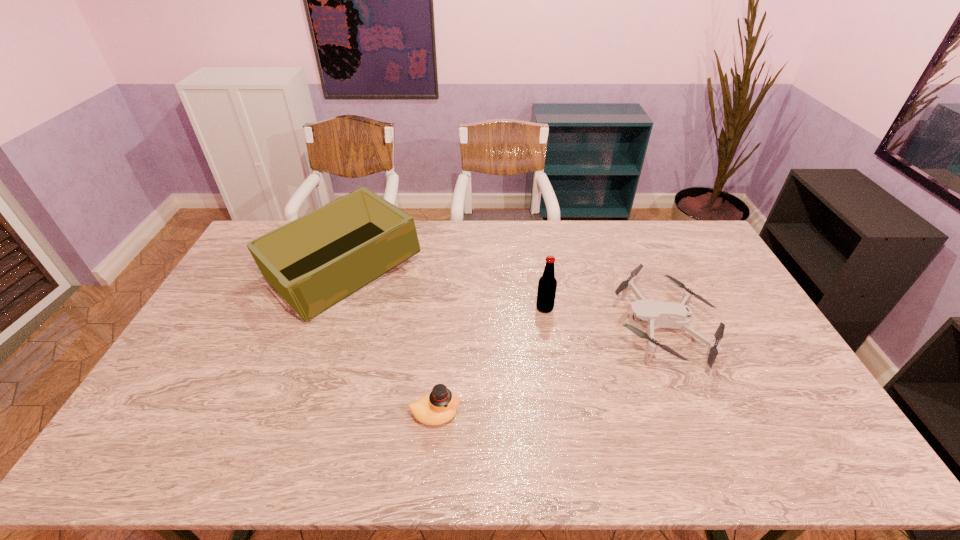
Image resolution: width=960 pixels, height=540 pixels. I want to click on the second object from right to left, so click(547, 284).

Where is `the leftmost object`? Image resolution: width=960 pixels, height=540 pixels. the leftmost object is located at coordinates (314, 262).

Where is `duck`? This screenshot has height=540, width=960. duck is located at coordinates (438, 407).

Find the location of a particular element. The width and height of the screenshot is (960, 540). the nearest object is located at coordinates (438, 407).

The image size is (960, 540). Identify the location of drone. (655, 314).

Where is `vacant space situated 0.210m on the right of the beer bottle`? This screenshot has height=540, width=960. vacant space situated 0.210m on the right of the beer bottle is located at coordinates point(618,308).

Identify the location of free space located 0.300m on the right of the leftmost object. (506, 271).

Where is `vacant region located 0.090m on the front-facing side of the duck`? The image size is (960, 540). vacant region located 0.090m on the front-facing side of the duck is located at coordinates (494, 414).

Locate an element on the screen. The height and width of the screenshot is (540, 960). free space located with a camera at the front of the rightmost object is located at coordinates 575,327.

Where is `vacant space located with a camera at the front of the rightmost object`? The image size is (960, 540). vacant space located with a camera at the front of the rightmost object is located at coordinates (494, 327).